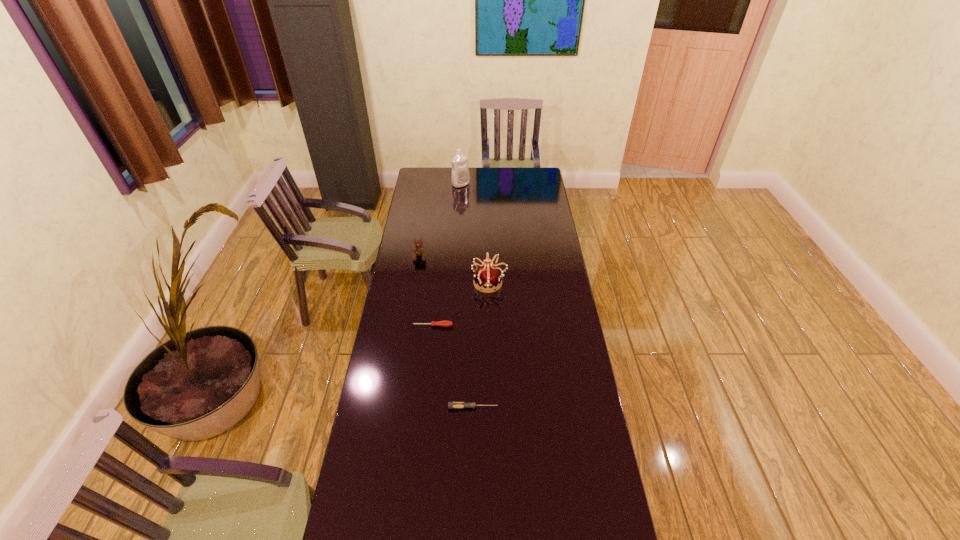
This screenshot has height=540, width=960. I want to click on free space located on the front of the detergent, so click(459, 213).

Where is `vacant region located on the front-facing side of the fourth shortest object`? Image resolution: width=960 pixels, height=540 pixels. vacant region located on the front-facing side of the fourth shortest object is located at coordinates 396,282.

The height and width of the screenshot is (540, 960). Find the location of `blank space located on the front-facing side of the fourth shortest object`. blank space located on the front-facing side of the fourth shortest object is located at coordinates (444, 282).

This screenshot has width=960, height=540. Identify the location of vacant space located 0.160m on the front-facing side of the fourth shortest object. (437, 282).

Find the location of a particular element. This screenshot has height=540, width=960. free space located 0.300m on the face of the teddy bear is located at coordinates (412, 306).

I want to click on vacant space located on the front of the farther screwdriver, so click(x=426, y=384).

Where is `free region located insert the right screwdriver into a screw head`? free region located insert the right screwdriver into a screw head is located at coordinates (560, 407).

Locate an element on the screen. The height and width of the screenshot is (540, 960). object present at the far edge is located at coordinates (460, 177).

Find the location of `teddy bear located in the left edge section of the desktop`. teddy bear located in the left edge section of the desktop is located at coordinates click(x=418, y=249).

Identify the location of screwdriver positioned at the left edge. [x=440, y=323].